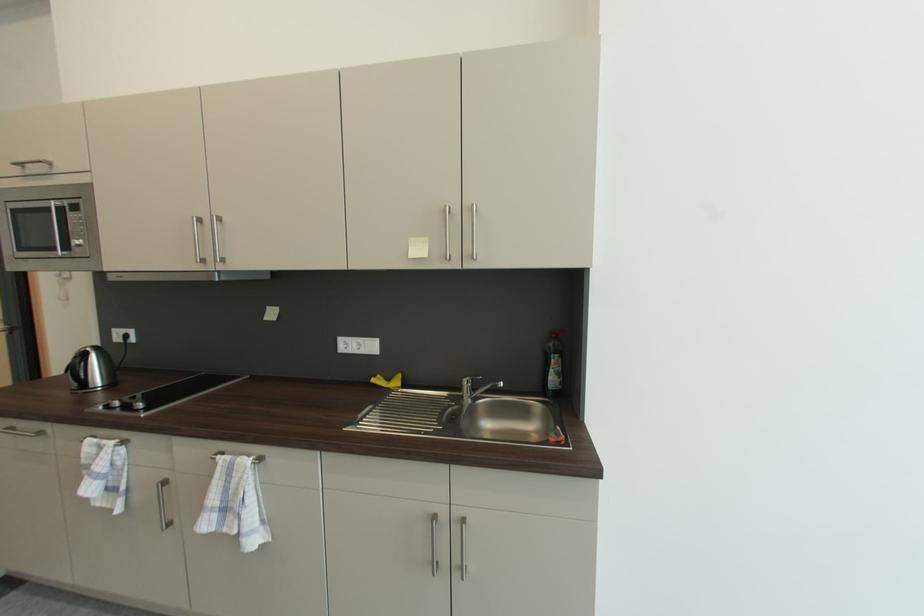
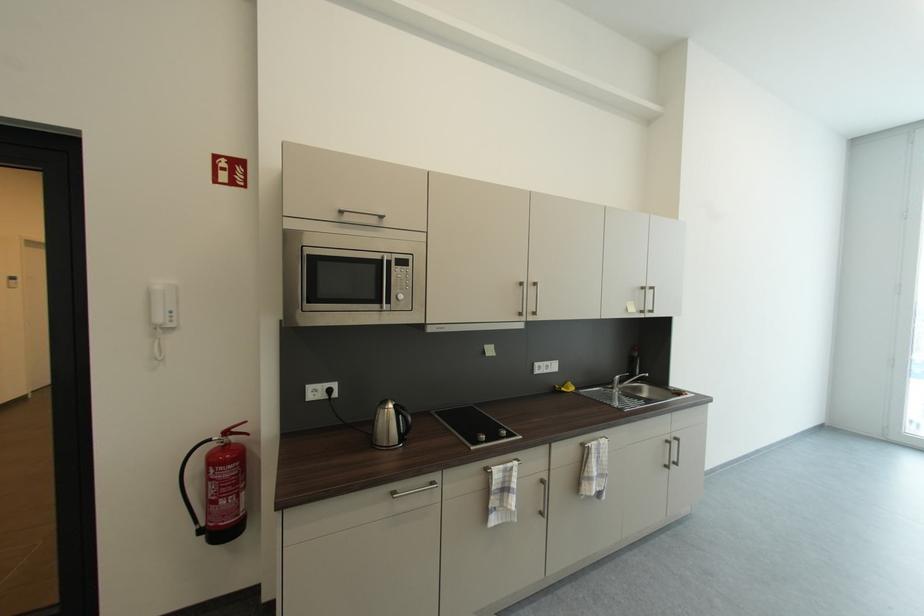
Locate, in the second image, the point that corresponds to (76,207) in the first image.

(403, 261)